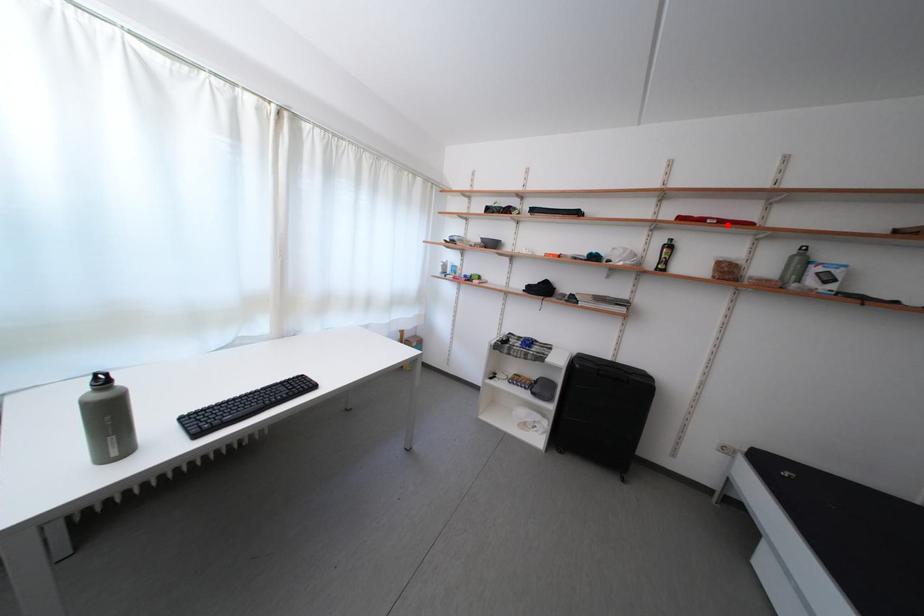
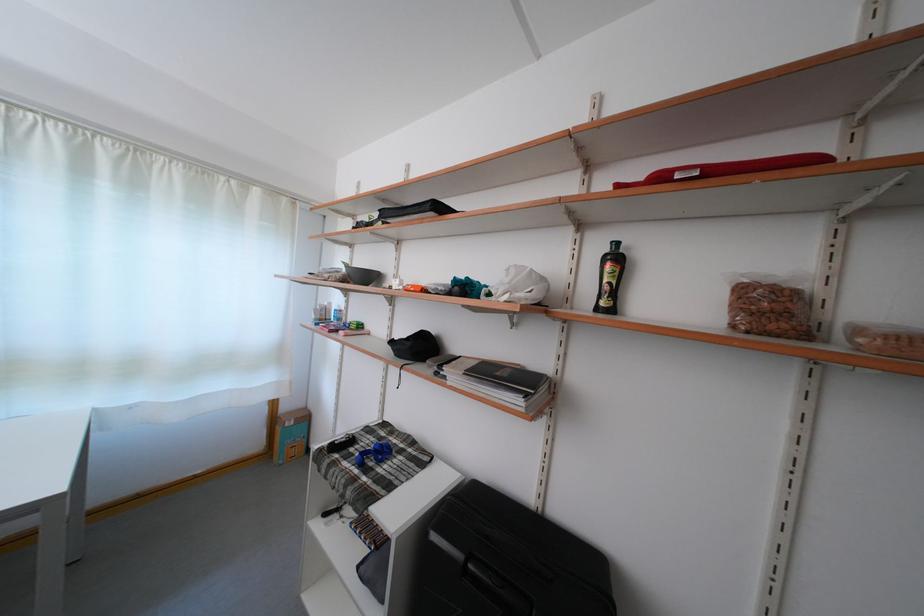
The point at the highlighted location is marked in the first image. Where is the corresponding point in the second image?

(713, 172)